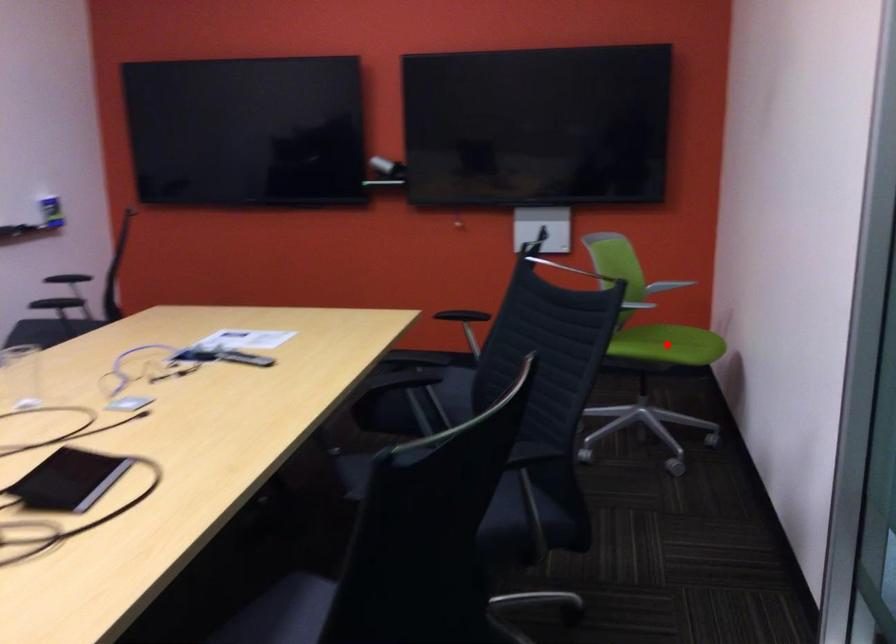
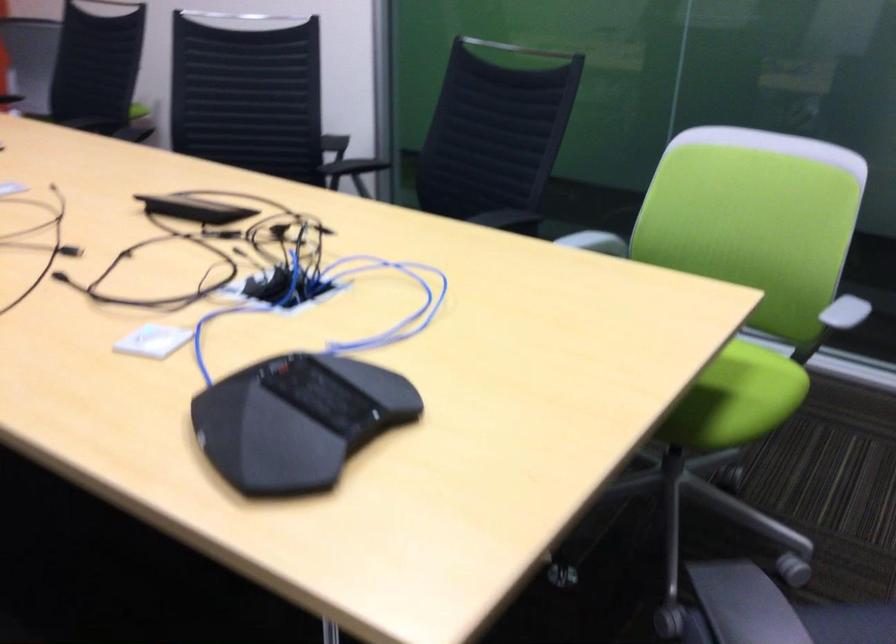
Question: I am providing you with two images of the same scene from different viewpoints. A red point is marked on the first image. Can you still see the location of the red point in image 2?

Choices:
 (A) Yes
 (B) No

Answer: (B)